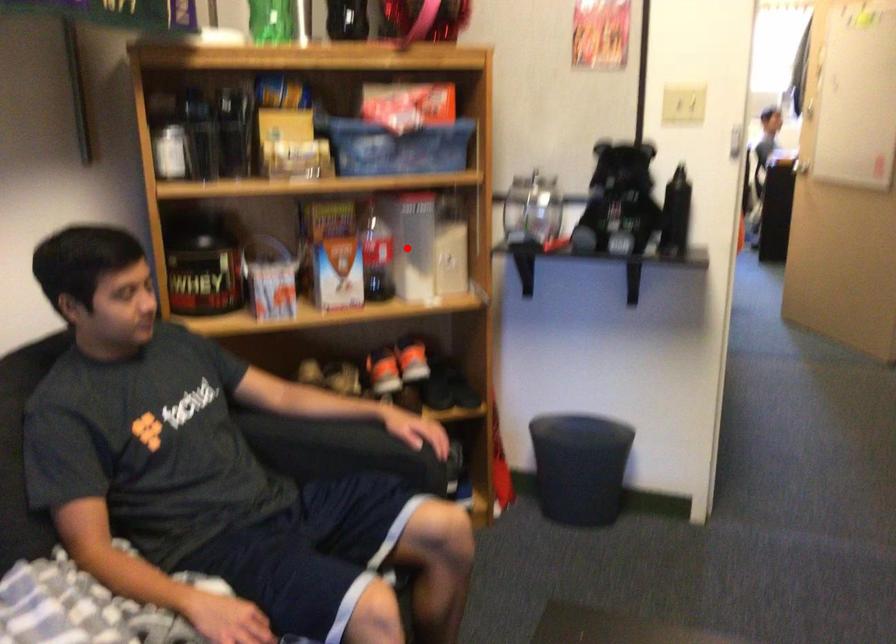
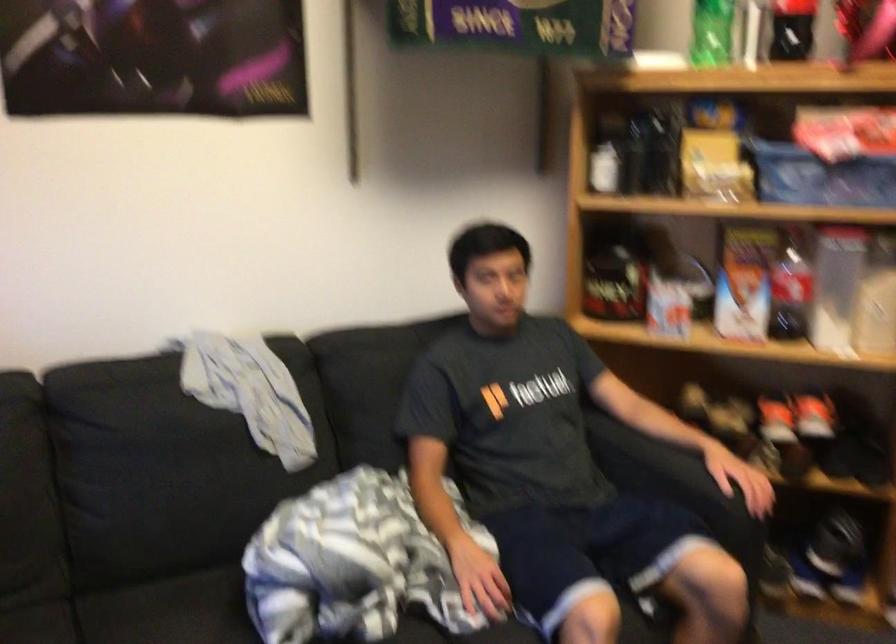
Locate, in the second image, the point that corresponds to the highlighted location in the first image.

(836, 287)